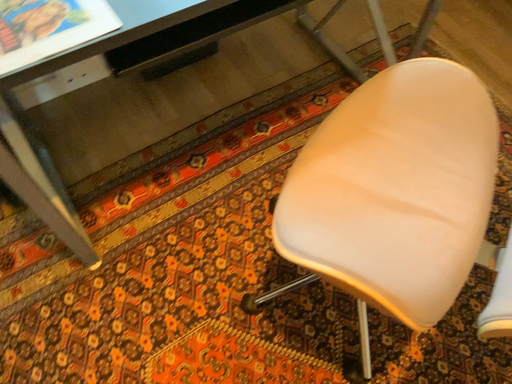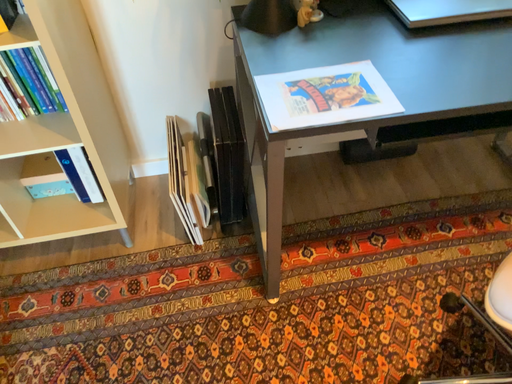
Question: How did the camera likely rotate when shooting the video?

Choices:
 (A) rotated left
 (B) rotated right

Answer: (A)